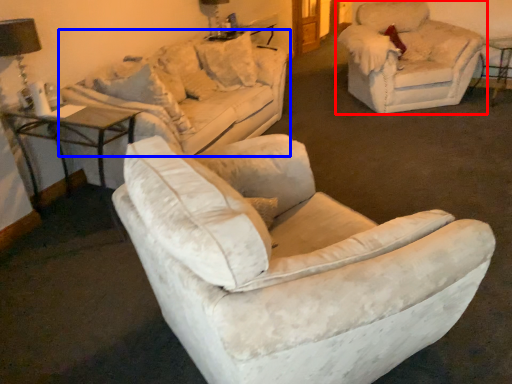
Question: Which object appears farthest to the camera in this image, chair (highlighted by a red box) or studio couch (highlighted by a blue box)?

Choices:
 (A) chair
 (B) studio couch

Answer: (A)